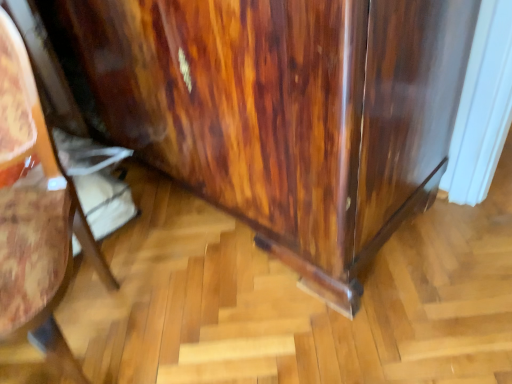
Question: In the image, is glossy wood cabinet at lower right on the left side or the right side of glossy wood dresser at lower right?

Choices:
 (A) right
 (B) left

Answer: (B)

Question: In terms of width, does glossy wood cabinet at lower right look wider or thinner when compared to glossy wood dresser at lower right?

Choices:
 (A) thin
 (B) wide

Answer: (A)

Question: In terms of size, does glossy wood cabinet at lower right appear bigger or smaller than glossy wood dresser at lower right?

Choices:
 (A) big
 (B) small

Answer: (B)

Question: Does point (115, 39) appear closer or farther from the camera than point (58, 261)?

Choices:
 (A) closer
 (B) farther

Answer: (B)

Question: Is glossy wood dresser at lower right wider or thinner than glossy wood cabinet at lower right?

Choices:
 (A) wide
 (B) thin

Answer: (A)

Question: Is glossy wood dresser at lower right taller or shorter than glossy wood cabinet at lower right?

Choices:
 (A) tall
 (B) short

Answer: (A)

Question: Is glossy wood dresser at lower right inside or outside of glossy wood cabinet at lower right?

Choices:
 (A) inside
 (B) outside

Answer: (B)